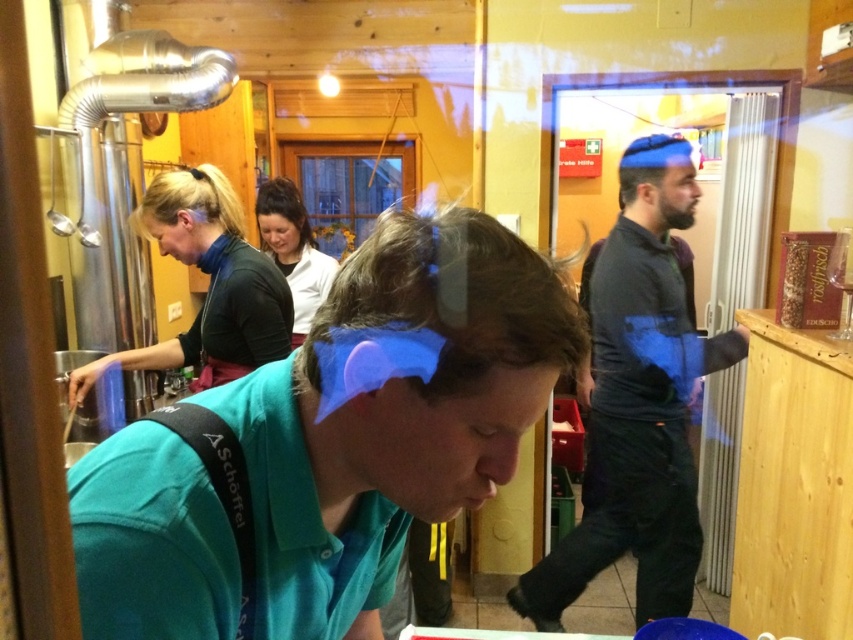
Who is positioned more to the left, dark gray sweater at center or matte black shirt at center?

Positioned to the left is matte black shirt at center.

Is the position of dark gray sweater at center more distant than that of matte black shirt at center?

Yes, it is.

Find the location of a particular element. dark gray sweater at center is located at coordinates (637, 403).

The width and height of the screenshot is (853, 640). I want to click on dark gray sweater at center, so click(637, 403).

Is teal fabric shirt at center positioned before matte black shirt at center?

Yes, it is in front of matte black shirt at center.

Is teal fabric shirt at center to the left of matte black shirt at center from the viewer's perspective?

In fact, teal fabric shirt at center is to the right of matte black shirt at center.

Is point (376, 369) positioned after point (207, 346)?

No, (376, 369) is in front of (207, 346).

Image resolution: width=853 pixels, height=640 pixels. I want to click on teal fabric shirt at center, so click(x=393, y=410).

Is point (171, 465) less distant than point (666, 170)?

Yes, it is in front of point (666, 170).

Is teal fabric shirt at center shorter than dark gray sweater at center?

Yes, teal fabric shirt at center is shorter than dark gray sweater at center.

The width and height of the screenshot is (853, 640). Find the location of `teal fabric shirt at center`. teal fabric shirt at center is located at coordinates (393, 410).

You are a GUI agent. You are given a task and a screenshot of the screen. Output one action in this format:
    pyautogui.click(x=<x>, y=<y>)
    Task: Click on the teal fabric shirt at center
    The image size is (853, 640).
    Given the screenshot: What is the action you would take?
    pyautogui.click(x=393, y=410)